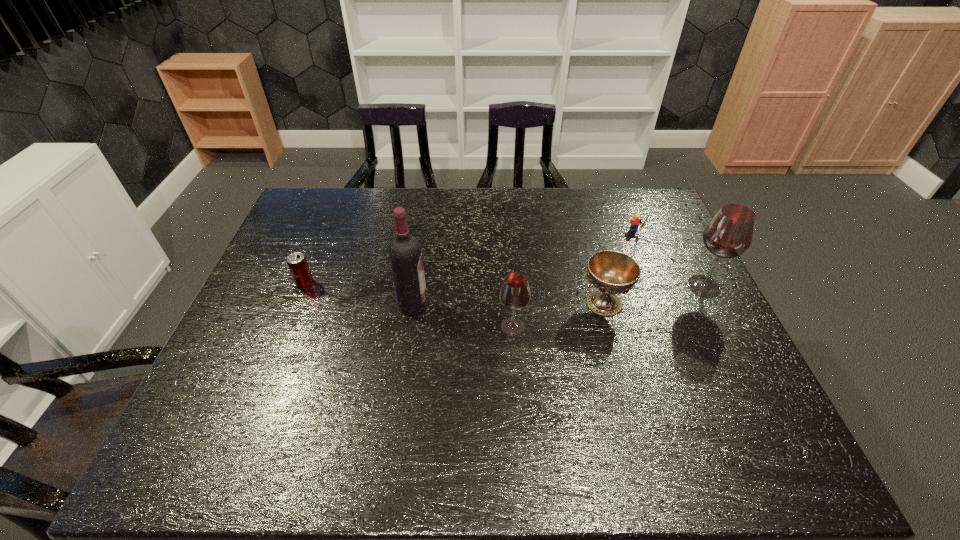
The height and width of the screenshot is (540, 960). I want to click on the fourth object from left to right, so click(x=612, y=272).

Where is `free spot located on the right of the left wineglass`? The height and width of the screenshot is (540, 960). free spot located on the right of the left wineglass is located at coordinates (642, 327).

Locate an element on the screen. The image size is (960, 540). free region located on the front of the rightmost object is located at coordinates (752, 379).

The width and height of the screenshot is (960, 540). I want to click on blank area located on the front-facing side of the fifth object from left to right, so click(652, 275).

Identify the location of vacant region located 0.060m on the label of the fifth object from right to left. (449, 305).

Locate an element on the screen. Image resolution: width=960 pixels, height=540 pixels. free space located 0.240m on the right of the leftmost object is located at coordinates (397, 284).

Identify the location of free location located on the front of the third object from right to left. (634, 411).

Where is `object that is positioned at the left edge`? Image resolution: width=960 pixels, height=540 pixels. object that is positioned at the left edge is located at coordinates (297, 263).

The width and height of the screenshot is (960, 540). Find the location of `wineglass that is at the right edge`. wineglass that is at the right edge is located at coordinates (729, 234).

This screenshot has width=960, height=540. Identify the location of Lego situated at the right edge. (634, 223).